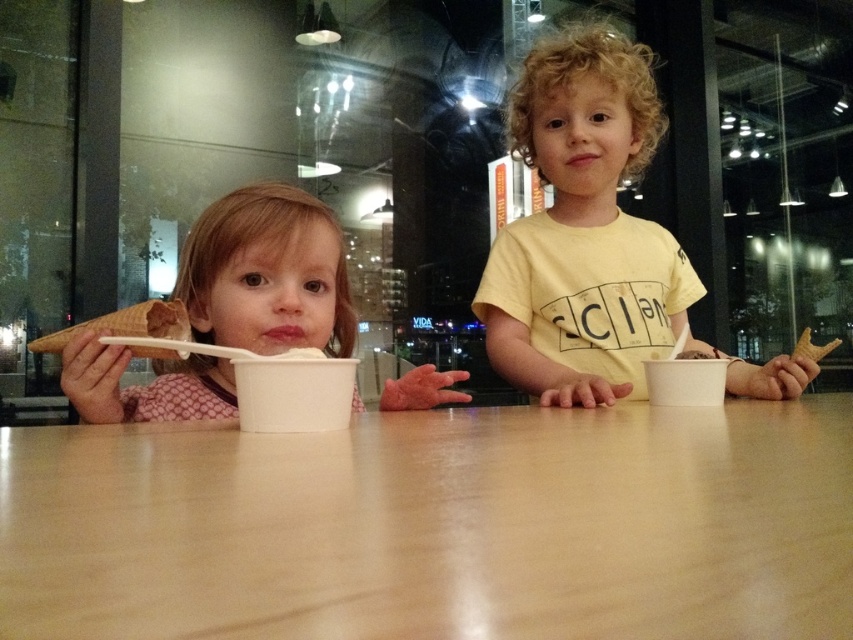
Is light brown wood table at center shorter than pink fabric shirt at left?

Correct, light brown wood table at center is not as tall as pink fabric shirt at left.

Between light brown wood table at center and pink fabric shirt at left, which one is positioned lower?

light brown wood table at center is below.

Between point (624, 454) and point (175, 284), which one is positioned behind?

Positioned behind is point (175, 284).

The image size is (853, 640). Find the location of `light brown wood table at center`. light brown wood table at center is located at coordinates (436, 525).

Can you confirm if light brown wood table at center is smaller than white paper cup at center?

Actually, light brown wood table at center might be larger than white paper cup at center.

Is point (654, 547) positioned behind point (248, 401)?

No, (654, 547) is in front of (248, 401).

Which is behind, point (575, 433) or point (257, 388)?

Positioned behind is point (257, 388).

This screenshot has width=853, height=640. I want to click on light brown wood table at center, so click(x=436, y=525).

Can you confirm if pink fabric shirt at left is positioned to the left of chocolate waffle cone at left?

In fact, pink fabric shirt at left is to the right of chocolate waffle cone at left.

Between pink fabric shirt at left and chocolate waffle cone at left, which one appears on the left side from the viewer's perspective?

From the viewer's perspective, chocolate waffle cone at left appears more on the left side.

The height and width of the screenshot is (640, 853). Identify the location of pink fabric shirt at left. (267, 273).